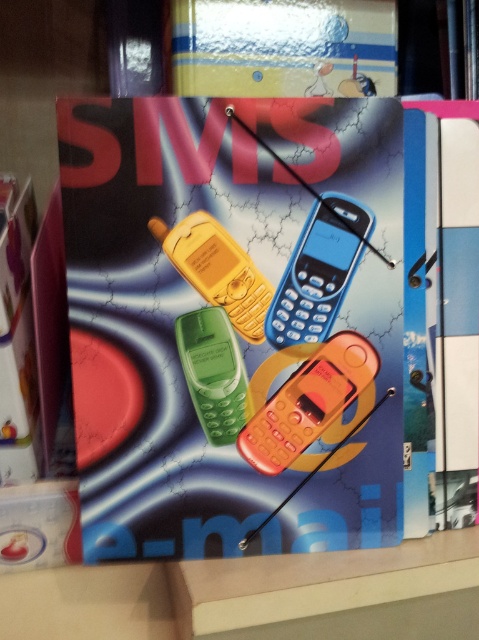
You are organizing a tech exhibition and need to place the matte plastic folder at center and the white glossy box at lower left on a display table. The table has limited space. Which object requires more horizontal space due to its width?

The matte plastic folder at center requires more horizontal space because its width surpasses that of the white glossy box at lower left.

You are organizing a tech exhibition and need to place a matte plastic folder at center and a green matte phone at center on a display table. According to the poster, which object should be placed to the left to ensure proper alignment?

The green matte phone at center should be placed to the left because the matte plastic folder at center is positioned on its right side according to the poster.